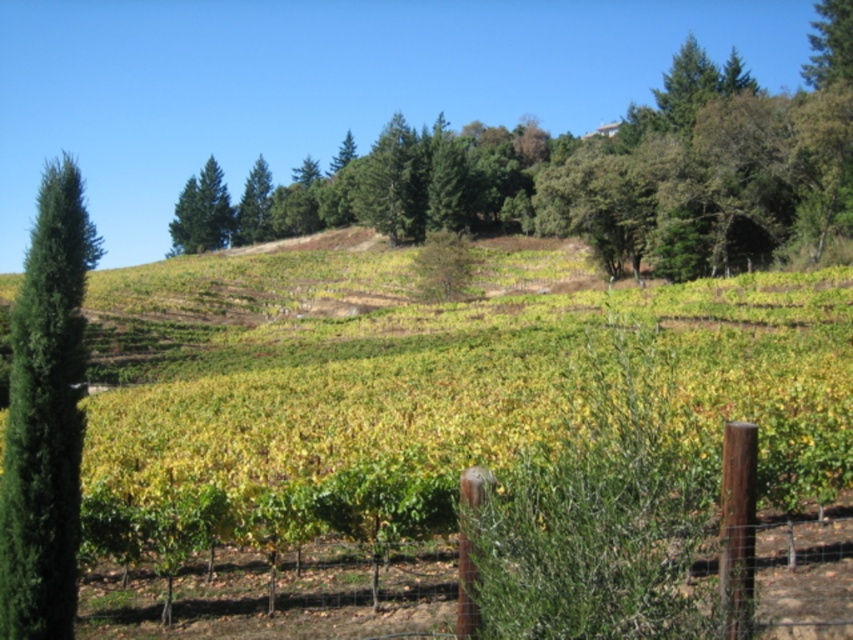
Between green leafy hillside at center and green leafy tree at upper center, which one is positioned higher?

green leafy tree at upper center

Which is more to the right, green leafy hillside at center or green leafy tree at upper center?

Positioned to the right is green leafy tree at upper center.

Where is `green leafy hillside at center`? green leafy hillside at center is located at coordinates (384, 360).

Does green leafy tree at upper center have a greater height compared to green textured tree at left?

In fact, green leafy tree at upper center may be shorter than green textured tree at left.

The height and width of the screenshot is (640, 853). Describe the element at coordinates (590, 173) in the screenshot. I see `green leafy tree at upper center` at that location.

Describe the element at coordinates (590, 173) in the screenshot. I see `green leafy tree at upper center` at that location.

Locate an element on the screen. green leafy tree at upper center is located at coordinates (590, 173).

This screenshot has height=640, width=853. Find the location of `green leafy tree at upper center`. green leafy tree at upper center is located at coordinates (590, 173).

Is point (822, 177) behind point (194, 614)?

Yes, it is.

What do you see at coordinates (590, 173) in the screenshot? I see `green leafy tree at upper center` at bounding box center [590, 173].

Where is `green leafy tree at upper center`? This screenshot has width=853, height=640. green leafy tree at upper center is located at coordinates (590, 173).